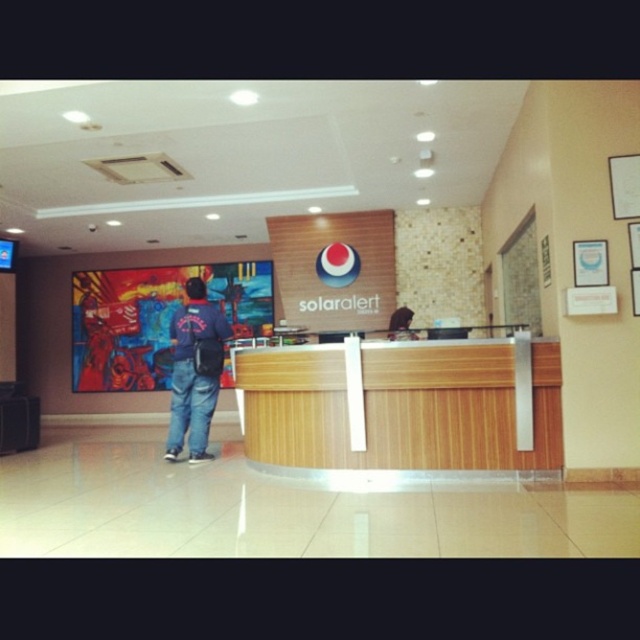
Is wooden reception desk at center to the right of wooden/textured reception desk at center from the viewer's perspective?

No, wooden reception desk at center is not to the right of wooden/textured reception desk at center.

Who is taller, wooden reception desk at center or wooden/textured reception desk at center?

With more height is wooden reception desk at center.

This screenshot has height=640, width=640. Describe the element at coordinates (496, 320) in the screenshot. I see `wooden reception desk at center` at that location.

Find the location of a particular element. The height and width of the screenshot is (640, 640). wooden reception desk at center is located at coordinates (496, 320).

Is wooden/textured reception desk at center shorter than denim jacket at center?

Indeed, wooden/textured reception desk at center has a lesser height compared to denim jacket at center.

Between wooden/textured reception desk at center and denim jacket at center, which one is positioned higher?

denim jacket at center is above.

I want to click on wooden/textured reception desk at center, so click(x=401, y=406).

Measure the distance between point (604, 232) and camera.

They are 4.49 meters apart.

Can you confirm if wooden reception desk at center is positioned below denim jacket at center?

No.

From the picture: Measure the distance between point (582, 88) and camera.

Point (582, 88) is 15.02 feet from camera.

Locate an element on the screen. The width and height of the screenshot is (640, 640). wooden reception desk at center is located at coordinates (496, 320).